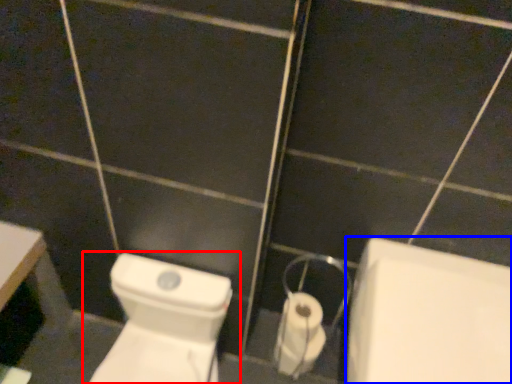
Question: Which point is closer to the camera, toilet (highlighted by a red box) or bath (highlighted by a blue box)?

Choices:
 (A) toilet
 (B) bath

Answer: (B)